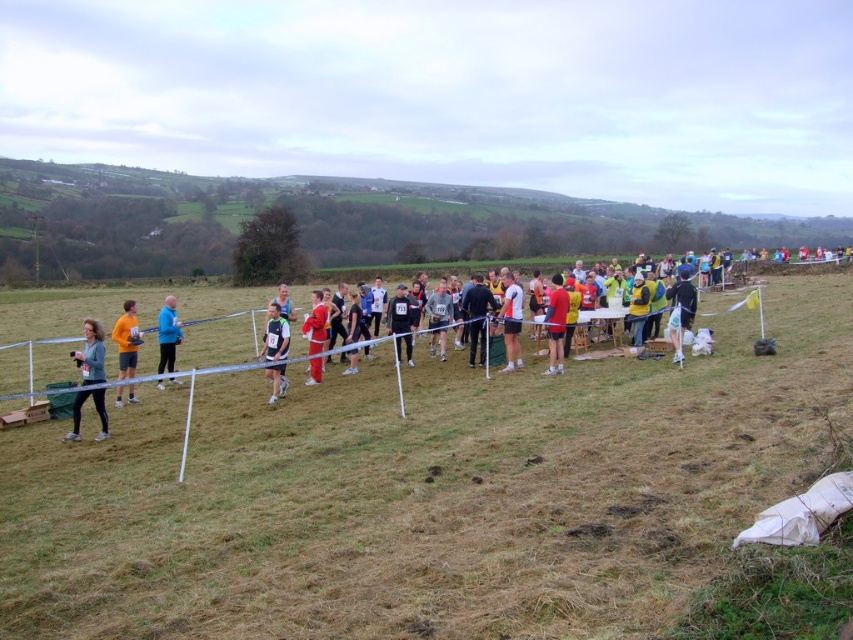
Is point (561, 339) less distant than point (508, 285)?

Yes, point (561, 339) is closer to viewer.

Which is behind, point (563, 314) or point (521, 305)?

The point (521, 305) is behind.

The width and height of the screenshot is (853, 640). Identify the location of red matte shirt at center. (556, 324).

Is point (515, 339) behind point (399, 289)?

No.

Can you confirm if white matte shirt at center is smaller than black matte jacket at center?

Yes, white matte shirt at center is smaller than black matte jacket at center.

Is point (515, 324) positioned in front of point (401, 320)?

Yes, it is in front of point (401, 320).

You are a GUI agent. You are given a task and a screenshot of the screen. Output one action in this format:
    pyautogui.click(x=<x>, y=<y>)
    Task: Click on the white matte shirt at center
    This screenshot has height=640, width=853.
    Given the screenshot: What is the action you would take?
    pyautogui.click(x=511, y=321)

Between black matte jacket at center and blue fabric jacket at center, which one is positioned lower?

blue fabric jacket at center

Locate an element on the screen. The image size is (853, 640). black matte jacket at center is located at coordinates (402, 321).